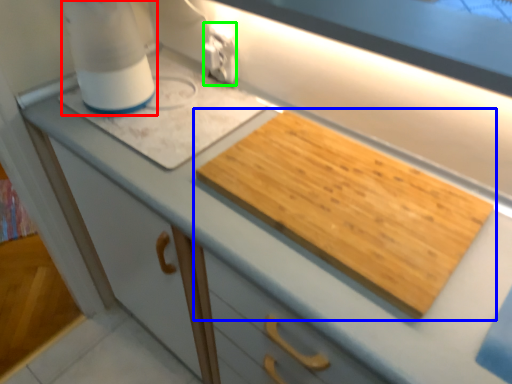
Question: Estimate the real-world distances between objects in this image. Which object is closer to blender (highlighted by a red box), cutting board (highlighted by a blue box) or electric outlet (highlighted by a green box)?

Choices:
 (A) cutting board
 (B) electric outlet

Answer: (B)